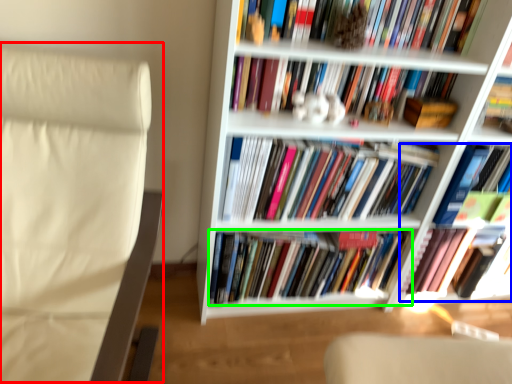
Question: Based on their relative distances, which object is nearer to rocking chair (highlighted by a red box)? Choose from book (highlighted by a blue box) and book (highlighted by a green box).

Choices:
 (A) book
 (B) book

Answer: (B)